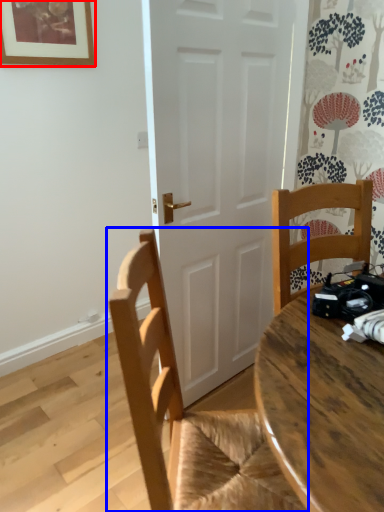
Question: Which object is further to the camera taking this photo, picture frame (highlighted by a red box) or chair (highlighted by a blue box)?

Choices:
 (A) picture frame
 (B) chair

Answer: (A)